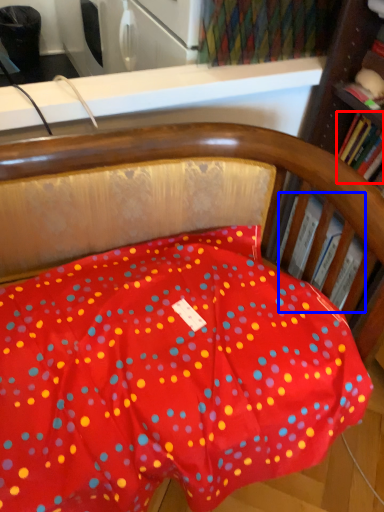
Question: Which of the following is the farthest to the observer, book (highlighted by a red box) or book (highlighted by a blue box)?

Choices:
 (A) book
 (B) book

Answer: (B)